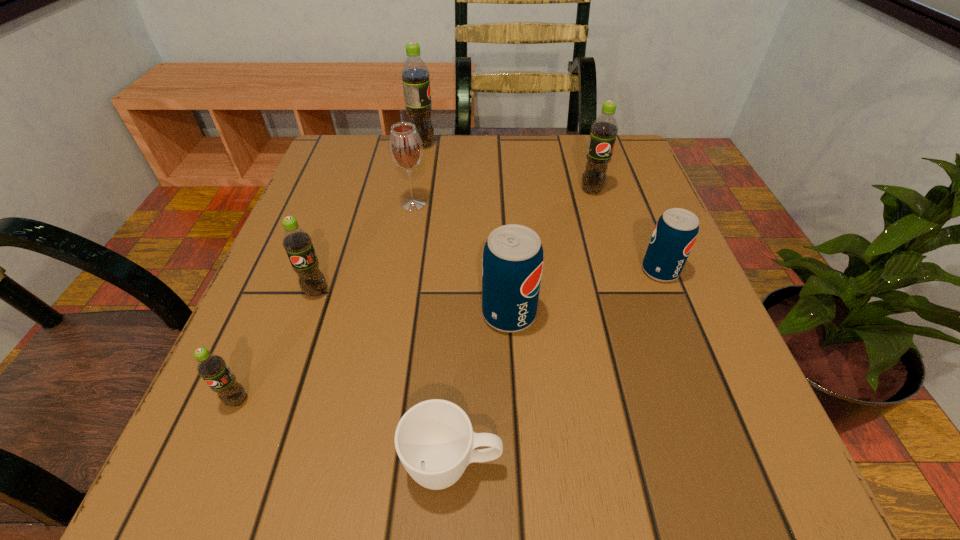
Find the location of a particular element. the right blue pop is located at coordinates (675, 233).

Where is `the second nearest object`? This screenshot has height=540, width=960. the second nearest object is located at coordinates (211, 367).

Where is `the nearest soda`? Image resolution: width=960 pixels, height=540 pixels. the nearest soda is located at coordinates (211, 367).

Identify the location of cup. This screenshot has height=540, width=960. (435, 442).

The image size is (960, 540). Identify the location of the nearest object. (435, 442).

Find the location of a particular element. Image resolution: width=960 pixels, height=540 pixels. vacant area located on the front label of the biggest green soda is located at coordinates (595, 145).

Where is `free region located on the front label of the third nearest green soda`? free region located on the front label of the third nearest green soda is located at coordinates point(604,231).

The width and height of the screenshot is (960, 540). In order to click on vacant position located 0.130m on the back of the wineglass in this screenshot , I will do `click(420, 161)`.

You are a GUI agent. You are given a task and a screenshot of the screen. Output one action in this format:
    pyautogui.click(x=<x>, y=<y>)
    Task: Click on the free location located on the back of the nearer blue pop
    Image resolution: width=960 pixels, height=540 pixels.
    Given the screenshot: What is the action you would take?
    pyautogui.click(x=504, y=229)

Locate an element on the screen. Image resolution: width=960 pixels, height=540 pixels. vacant space located on the front label of the seventh object from right to left is located at coordinates (280, 394).